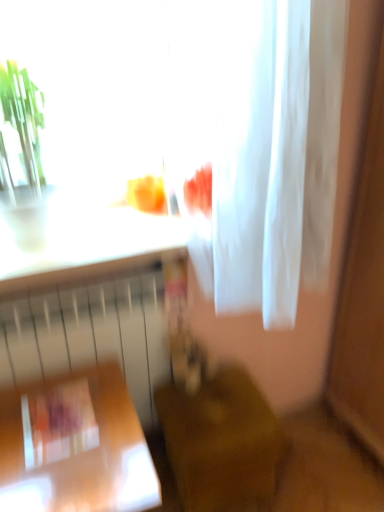
Question: From a real-world perspective, is white sheer fabric at upper center positioned under white matte radiator at lower left based on gravity?

Choices:
 (A) no
 (B) yes

Answer: (A)

Question: Does white sheer fabric at upper center have a smaller size compared to white matte radiator at lower left?

Choices:
 (A) yes
 (B) no

Answer: (B)

Question: Would you consider white sheer fabric at upper center to be distant from white matte radiator at lower left?

Choices:
 (A) yes
 (B) no

Answer: (B)

Question: Is white sheer fabric at upper center bigger than white matte radiator at lower left?

Choices:
 (A) yes
 (B) no

Answer: (A)

Question: From a real-world perspective, is white sheer fabric at upper center physically above white matte radiator at lower left?

Choices:
 (A) no
 (B) yes

Answer: (B)

Question: Is point (230, 373) positioned closer to the camera than point (158, 317)?

Choices:
 (A) farther
 (B) closer

Answer: (A)

Question: In terms of width, does wooden chair at lower center, which is the 2th furniture from left to right, look wider or thinner when compared to white matte radiator at lower left?

Choices:
 (A) thin
 (B) wide

Answer: (B)

Question: Considering their positions, is wooden chair at lower center, which is counted as the 1th furniture, starting from the right, located in front of or behind white matte radiator at lower left?

Choices:
 (A) behind
 (B) front

Answer: (A)

Question: Is wooden chair at lower center, which is counted as the 1th furniture, starting from the right, spatially inside white matte radiator at lower left, or outside of it?

Choices:
 (A) outside
 (B) inside

Answer: (A)

Question: From a real-world perspective, is white matte radiator at lower left positioned above or below wooden chair at lower center, which is the 2th furniture from left to right?

Choices:
 (A) below
 (B) above

Answer: (B)

Question: Considering their positions, is white matte radiator at lower left located in front of or behind wooden chair at lower center, which is counted as the 1th furniture, starting from the right?

Choices:
 (A) behind
 (B) front

Answer: (B)

Question: Is white matte radiator at lower left bigger or smaller than wooden chair at lower center, which is counted as the 1th furniture, starting from the right?

Choices:
 (A) small
 (B) big

Answer: (B)

Question: Considering the positions of white matte radiator at lower left and wooden chair at lower center, which is counted as the 1th furniture, starting from the right, in the image, is white matte radiator at lower left taller or shorter than wooden chair at lower center, which is counted as the 1th furniture, starting from the right,?

Choices:
 (A) tall
 (B) short

Answer: (A)

Question: From their relative heights in the image, would you say wooden table at lower left, positioned as the first furniture in left-to-right order, is taller or shorter than wooden chair at lower center, which is counted as the 1th furniture, starting from the right?

Choices:
 (A) tall
 (B) short

Answer: (A)

Question: Is point pyautogui.click(x=16, y=476) positioned closer to the camera than point pyautogui.click(x=230, y=372)?

Choices:
 (A) farther
 (B) closer

Answer: (B)